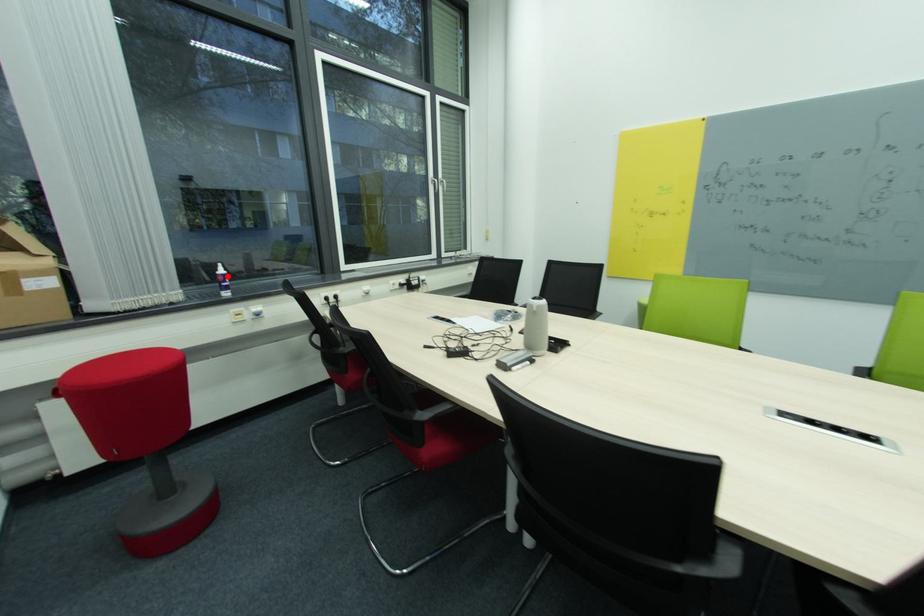
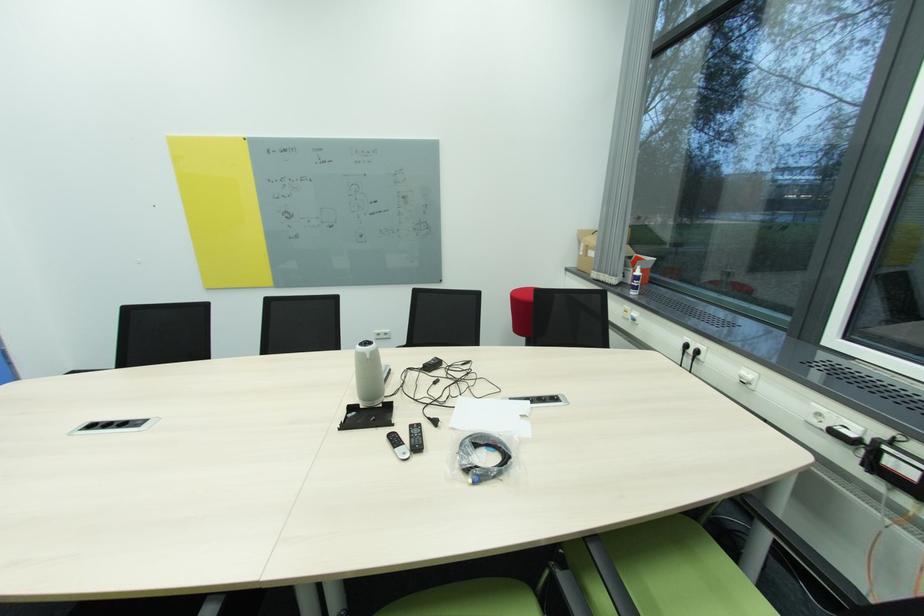
Question: I am providing you with two images of the same scene from different viewpoints. Image1 has a red point marked. In image2, the corresponding 3D location appears at what relative position? Reply with the corresponding letter.

Choices:
 (A) Closer
 (B) Farther

Answer: (B)